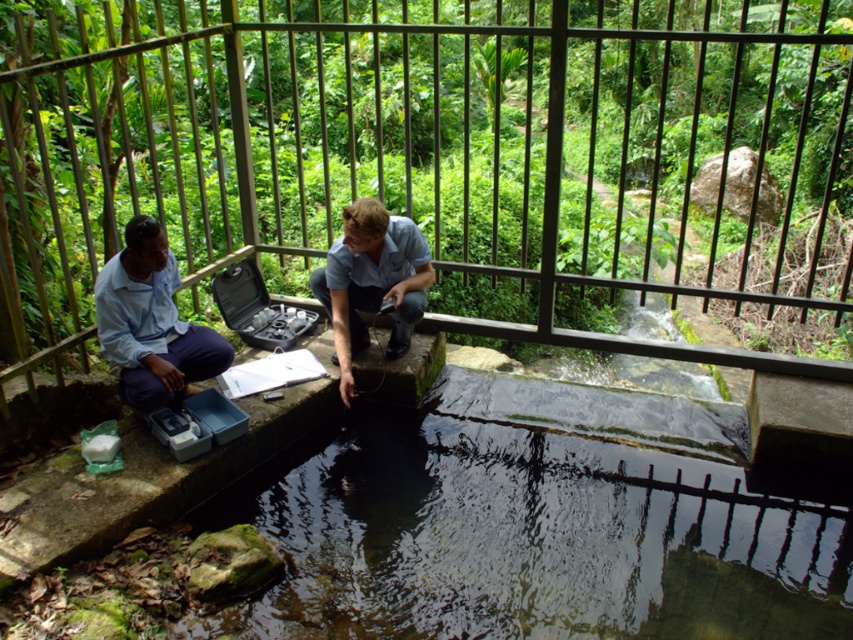
Does light blue shirt at left have a lesser width compared to blue cotton shirt at center?

Yes.

The width and height of the screenshot is (853, 640). What do you see at coordinates (151, 323) in the screenshot? I see `light blue shirt at left` at bounding box center [151, 323].

Who is more distant from viewer, (221,348) or (396,321)?

The point (396,321) is behind.

Where is `light blue shirt at left`? light blue shirt at left is located at coordinates (151, 323).

From the picture: Is blue cotton shirt at center wider than light blue shirt at center?

Yes, blue cotton shirt at center is wider than light blue shirt at center.

Which is behind, point (392, 264) or point (375, 304)?

The point (375, 304) is more distant.

What do you see at coordinates (372, 282) in the screenshot?
I see `blue cotton shirt at center` at bounding box center [372, 282].

At what (x,y) coordinates should I click in order to perform the action: click on blue cotton shirt at center. Please return your answer as a coordinate pair (x, y). The height and width of the screenshot is (640, 853). Looking at the image, I should click on (372, 282).

Between light blue shirt at left and light blue shirt at center, which one is positioned higher?

light blue shirt at center is above.

Which is behind, point (137, 275) or point (428, 285)?

The point (428, 285) is behind.

The height and width of the screenshot is (640, 853). Describe the element at coordinates (151, 323) in the screenshot. I see `light blue shirt at left` at that location.

Locate an element on the screen. Image resolution: width=853 pixels, height=640 pixels. light blue shirt at left is located at coordinates tap(151, 323).